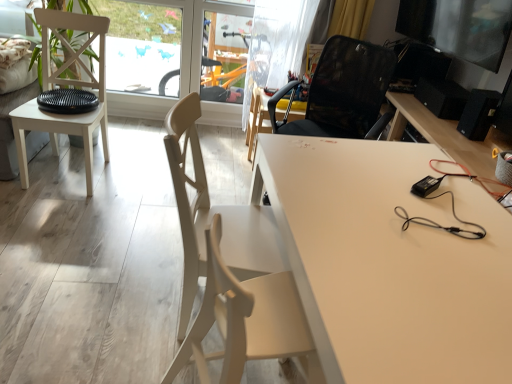
Locate an element on the screen. This screenshot has height=384, width=512. free spot to the right of white matte chair at left, which appears as the third chair when viewed from the front is located at coordinates (136, 181).